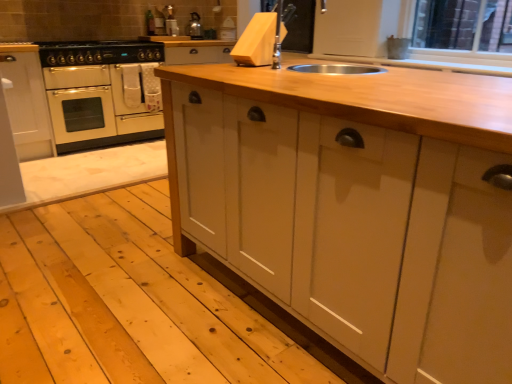
Question: From a real-world perspective, is black matte gas stove at upper left positioned over natural wood countertop at center based on gravity?

Choices:
 (A) yes
 (B) no

Answer: (A)

Question: Is black matte gas stove at upper left facing away from natural wood countertop at center?

Choices:
 (A) no
 (B) yes

Answer: (A)

Question: Is the position of black matte gas stove at upper left more distant than that of natural wood countertop at center?

Choices:
 (A) yes
 (B) no

Answer: (A)

Question: Is there a large distance between black matte gas stove at upper left and natural wood countertop at center?

Choices:
 (A) yes
 (B) no

Answer: (A)

Question: Does black matte gas stove at upper left appear on the left side of natural wood countertop at center?

Choices:
 (A) no
 (B) yes

Answer: (B)

Question: Can you confirm if black matte gas stove at upper left is smaller than natural wood countertop at center?

Choices:
 (A) yes
 (B) no

Answer: (A)

Question: Can you confirm if natural wood countertop at center is shorter than cream matte oven at left?

Choices:
 (A) no
 (B) yes

Answer: (A)

Question: From the image's perspective, is natural wood countertop at center on cream matte oven at left?

Choices:
 (A) yes
 (B) no

Answer: (B)

Question: Would you consider natural wood countertop at center to be distant from cream matte oven at left?

Choices:
 (A) no
 (B) yes

Answer: (B)

Question: Is natural wood countertop at center behind cream matte oven at left?

Choices:
 (A) no
 (B) yes

Answer: (A)

Question: Are natural wood countertop at center and cream matte oven at left beside each other?

Choices:
 (A) no
 (B) yes

Answer: (A)

Question: Does natural wood countertop at center appear on the left side of cream matte oven at left?

Choices:
 (A) yes
 (B) no

Answer: (B)

Question: Is cream matte oven at left to the right of metallic silver kettle at upper center from the viewer's perspective?

Choices:
 (A) yes
 (B) no

Answer: (B)